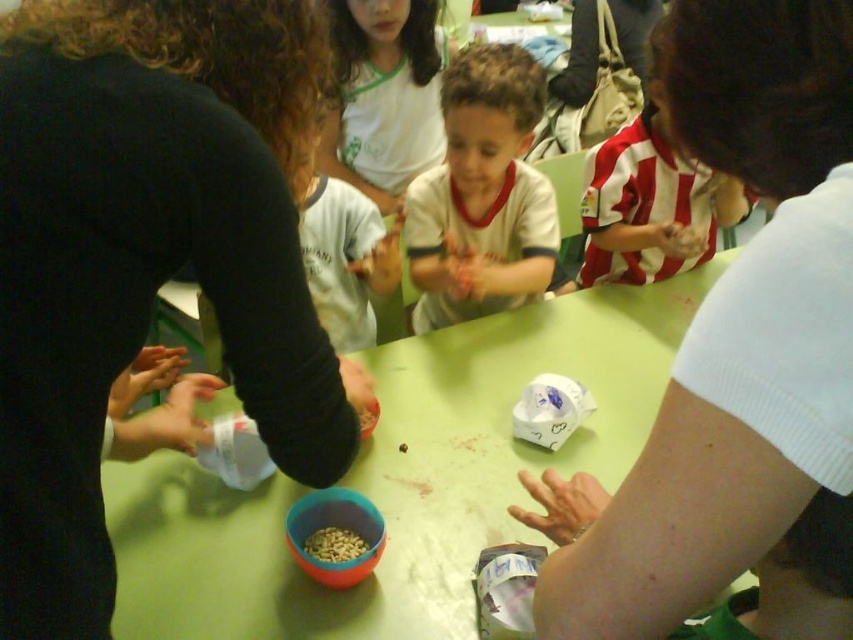
You are a photographer taking a picture of the table where the children are working. There are two points on the table surface that you need to focus on. The first point is at coordinates point (506, 67) and the second point is at point (320, 531). Which point should you focus on first to ensure the closest object is in focus?

You should focus on point (506, 67) first because it is closer to the camera than point (320, 531), so it should be in focus before adjusting for the other point.

You are a teacher observing the children at the table. You notice the black matte shirt at left and the white matte shirt at center. Which shirt is closer to the edge of the table?

The black matte shirt at left is positioned under the white matte shirt at center, so the white matte shirt at center is closer to the edge of the table.